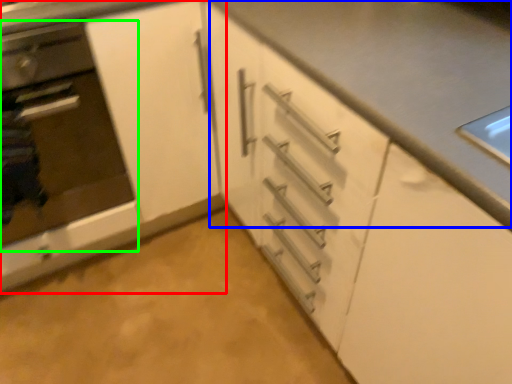
Question: Considering the real-world distances, which object is closest to cabinetry (highlighted by a red box)? counter top (highlighted by a blue box) or oven (highlighted by a green box).

Choices:
 (A) counter top
 (B) oven

Answer: (B)